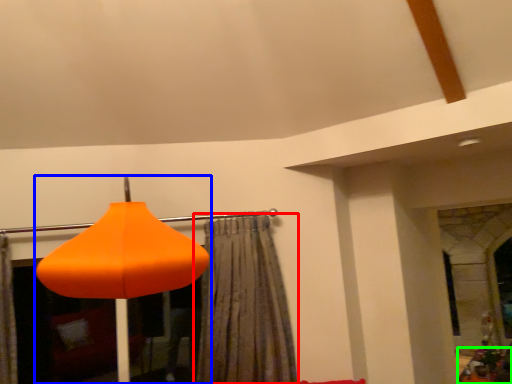
Question: Considering the real-world distances, which object is closest to curtain (highlighted by a red box)? lamp (highlighted by a blue box) or furniture (highlighted by a green box).

Choices:
 (A) lamp
 (B) furniture

Answer: (A)